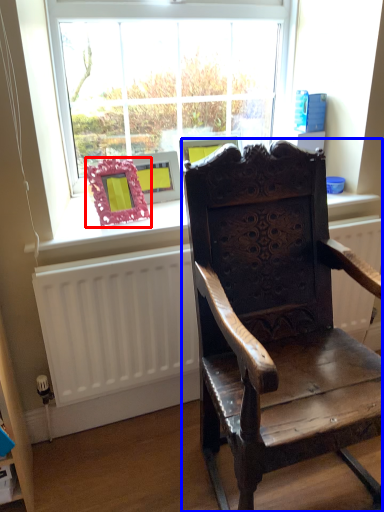
Question: Which object appears closest to the camera in this image, picture frame (highlighted by a red box) or chair (highlighted by a blue box)?

Choices:
 (A) picture frame
 (B) chair

Answer: (B)